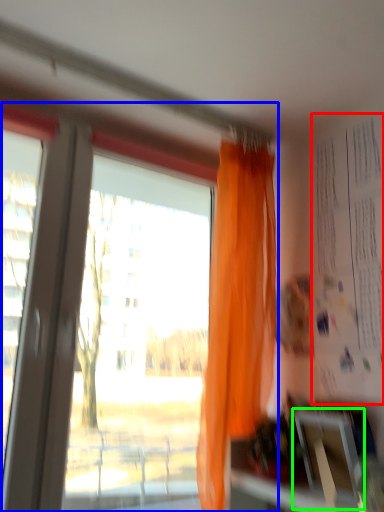
Question: Which object is positioned closest to bulletin board (highlighted by a red box)? Select from window (highlighted by a blue box) and window screen (highlighted by a green box).

Choices:
 (A) window
 (B) window screen

Answer: (B)